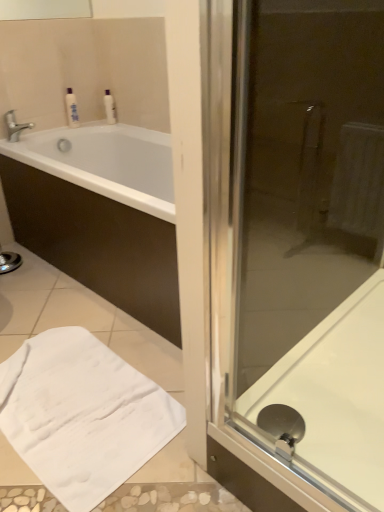
The width and height of the screenshot is (384, 512). Describe the element at coordinates (71, 109) in the screenshot. I see `white glossy bottle at upper left, the 2th toiletry when ordered from right to left` at that location.

Locate an element on the screen. The image size is (384, 512). white glossy bathtub at upper left is located at coordinates click(101, 214).

This screenshot has height=512, width=384. Describe the element at coordinates (101, 214) in the screenshot. I see `white glossy bathtub at upper left` at that location.

I want to click on silver metallic faucet at upper left, so click(x=15, y=126).

Describe the element at coordinates (82, 415) in the screenshot. I see `white soft towel at lower left` at that location.

I want to click on white glossy bottle at upper left, the 2th toiletry when ordered from right to left, so click(x=71, y=109).

At what (x,y) coordinates should I click in order to perform the action: click on bathtub that is under the silver metallic faucet at upper left (from a real-world perspective). Please return your answer as a coordinate pair (x, y). Looking at the image, I should click on (101, 214).

Based on the photo, which object is more forward, white glossy bathtub at upper left or silver metallic faucet at upper left?

Positioned in front is white glossy bathtub at upper left.

Between white glossy bathtub at upper left and silver metallic faucet at upper left, which one has smaller size?

With smaller size is silver metallic faucet at upper left.

From the image's perspective, is white glossy bathtub at upper left located above or below silver metallic faucet at upper left?

white glossy bathtub at upper left is situated lower than silver metallic faucet at upper left in the image.

Consider the image. Which of these two, white glossy bottle at upper left, the first toiletry viewed from the left, or white glossy bath at right, stands taller?

white glossy bath at right.

Is white glossy bottle at upper left, the first toiletry viewed from the left, facing towards white glossy bath at right?

Yes, white glossy bottle at upper left, the first toiletry viewed from the left, is aimed at white glossy bath at right.

Is white glossy bottle at upper left, the 2th toiletry when ordered from right to left, not close to white glossy bath at right?

That's right, there is a large distance between white glossy bottle at upper left, the 2th toiletry when ordered from right to left, and white glossy bath at right.

Does white glossy bottle at upper left, the 2th toiletry when ordered from right to left, have a greater width compared to white glossy bath at right?

In fact, white glossy bottle at upper left, the 2th toiletry when ordered from right to left, might be narrower than white glossy bath at right.

Based on the photo, is white glossy bottle at upper left, acting as the 1th toiletry starting from the right, at the back of white soft towel at lower left?

No, white soft towel at lower left's orientation is not away from white glossy bottle at upper left, acting as the 1th toiletry starting from the right.

Who is shorter, white soft towel at lower left or white glossy bottle at upper left, which is the 2th toiletry from left to right?

Standing shorter between the two is white soft towel at lower left.

In the image, is white soft towel at lower left positioned in front of or behind white glossy bottle at upper left, acting as the 1th toiletry starting from the right?

Clearly, white soft towel at lower left is in front of white glossy bottle at upper left, acting as the 1th toiletry starting from the right.

Is white glossy bottle at upper left, which is the 2th toiletry from left to right, positioned beyond the bounds of white glossy bathtub at upper left?

That's correct, white glossy bottle at upper left, which is the 2th toiletry from left to right, is outside of white glossy bathtub at upper left.

From the white glossy bathtub at upper left, count 2nd toiletrys backward and point to it. Please provide its 2D coordinates.

[(110, 106)]

Which is closer, (104, 99) or (128, 132)?

Clearly, point (104, 99) is more distant from the camera than point (128, 132).

Is point (107, 117) positioned after point (72, 108)?

That is True.

Does white glossy bottle at upper left, which is the 2th toiletry from left to right, turn towards white glossy bottle at upper left, the first toiletry viewed from the left?

No, white glossy bottle at upper left, which is the 2th toiletry from left to right, is not oriented towards white glossy bottle at upper left, the first toiletry viewed from the left.

Does white glossy bottle at upper left, which is the 2th toiletry from left to right, have a smaller size compared to white glossy bottle at upper left, the first toiletry viewed from the left?

Correct, white glossy bottle at upper left, which is the 2th toiletry from left to right, occupies less space than white glossy bottle at upper left, the first toiletry viewed from the left.

Based on the photo, is the surface of white glossy bottle at upper left, acting as the 1th toiletry starting from the right, in direct contact with white glossy bottle at upper left, the first toiletry viewed from the left?

No, white glossy bottle at upper left, acting as the 1th toiletry starting from the right, is not with white glossy bottle at upper left, the first toiletry viewed from the left.

From the image's perspective, is white soft towel at lower left located above or below white glossy bath at right?

white soft towel at lower left is situated lower than white glossy bath at right in the image.

Could white glossy bath at right be considered to be inside white soft towel at lower left?

No, white soft towel at lower left does not contain white glossy bath at right.

Does white soft towel at lower left have a greater height compared to white glossy bath at right?

No.

Considering the positions of points (67, 342) and (242, 400), is point (67, 342) closer to camera compared to point (242, 400)?

No, it is not.

Could you tell me if white glossy bath at right is turned towards white soft towel at lower left?

No, white glossy bath at right is not aimed at white soft towel at lower left.

Looking at this image, which object is further away from the camera taking this photo, white glossy bath at right or white soft towel at lower left?

white soft towel at lower left is more distant.

Can you see white glossy bath at right touching white soft towel at lower left?

No.

I want to click on bathtub below the silver metallic faucet at upper left (from a real-world perspective), so click(x=101, y=214).

Where is `the 1st toiletry above the white glossy bath at right (from the image's perspective)`? the 1st toiletry above the white glossy bath at right (from the image's perspective) is located at coordinates tap(71, 109).

Which object lies further to the anchor point white soft towel at lower left, silver metallic faucet at upper left or white glossy bath at right?

silver metallic faucet at upper left is further to white soft towel at lower left.

From the image, which object appears to be nearer to white glossy bathtub at upper left, silver metallic faucet at upper left or white soft towel at lower left?

Based on the image, white soft towel at lower left appears to be nearer to white glossy bathtub at upper left.

From the image, which object appears to be farther from white soft towel at lower left, white glossy bottle at upper left, the first toiletry viewed from the left, or white glossy bottle at upper left, which is the 2th toiletry from left to right?

Among the two, white glossy bottle at upper left, which is the 2th toiletry from left to right, is located further to white soft towel at lower left.

Considering their positions, is white glossy bath at right positioned closer to white glossy bottle at upper left, which is the 2th toiletry from left to right, than white soft towel at lower left?

white soft towel at lower left lies closer to white glossy bottle at upper left, which is the 2th toiletry from left to right, than the other object.

Looking at the image, which one is located closer to white soft towel at lower left, silver metallic faucet at upper left or white glossy bathtub at upper left?

white glossy bathtub at upper left.

When comparing their distances from white soft towel at lower left, does white glossy bottle at upper left, acting as the 1th toiletry starting from the right, or white glossy bathtub at upper left seem closer?

Based on the image, white glossy bathtub at upper left appears to be nearer to white soft towel at lower left.

Which object lies further to the anchor point white glossy bottle at upper left, which is the 2th toiletry from left to right, silver metallic faucet at upper left or white soft towel at lower left?

white soft towel at lower left is further to white glossy bottle at upper left, which is the 2th toiletry from left to right.

When comparing their distances from white soft towel at lower left, does white glossy bathtub at upper left or white glossy bottle at upper left, which is the 2th toiletry from left to right, seem further?

The object further to white soft towel at lower left is white glossy bottle at upper left, which is the 2th toiletry from left to right.

Find the location of a particular element. Image resolution: width=384 pixels, height=512 pixels. bathtub between white glossy bath at right and white glossy bottle at upper left, which is the 2th toiletry from left to right, in the front-back direction is located at coordinates (101, 214).

Find the location of a particular element. This screenshot has height=512, width=384. tap between white glossy bathtub at upper left and white glossy bottle at upper left, the first toiletry viewed from the left, in the front-back direction is located at coordinates (15, 126).

At what (x,y) coordinates should I click in order to perform the action: click on tap between white glossy bottle at upper left, which is the 2th toiletry from left to right, and white soft towel at lower left in the up-down direction. Please return your answer as a coordinate pair (x, y). Image resolution: width=384 pixels, height=512 pixels. Looking at the image, I should click on (15, 126).

I want to click on tap between white glossy bath at right and white glossy bottle at upper left, acting as the 1th toiletry starting from the right, from front to back, so click(x=15, y=126).